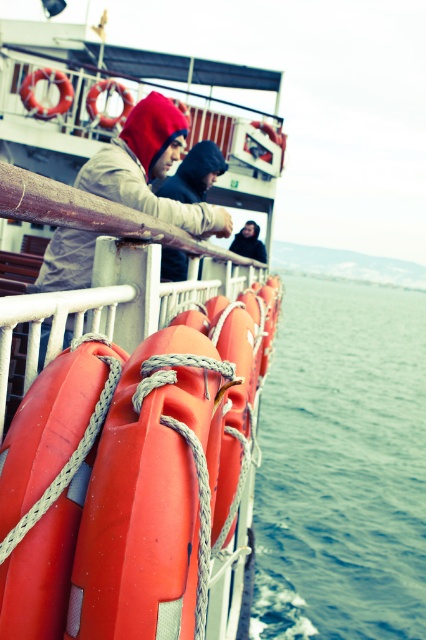
You are standing on the ferry deck and want to know which of the two points, point (32, 618) or point (161, 156), is closer to you. Based on the scene, can you determine this?

Point (32, 618) is closer to the viewer than point (161, 156).

You are standing on the ferry deck and notice both the rubber lifebuoys at center and the matte beige hoodie at center. Which object is positioned higher relative to the other?

The rubber lifebuoys at center are located above the matte beige hoodie at center, so they are positioned higher.

You are a passenger on the ferry and want to know if you can fit your dark gray hoodie at center into the space between two rubber lifebuoys at center. Based on their sizes, what do you think?

The rubber lifebuoys at center are larger than the dark gray hoodie at center, so there might be enough space between them to fit the hoodie. However, the exact fit depends on the arrangement and spacing of the lifebuoys.